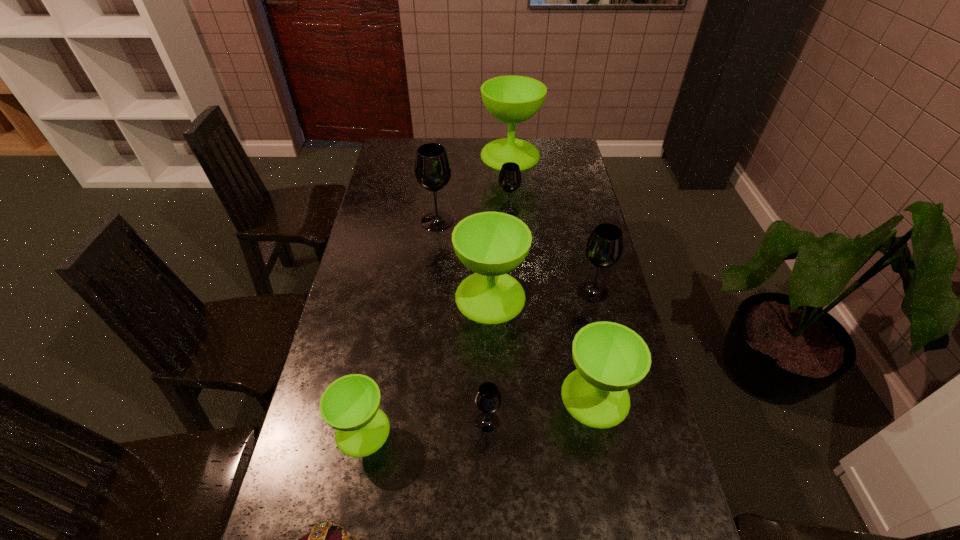
Locate an element on the screen. The width and height of the screenshot is (960, 540). vacant space that satisfies the following two spatial constraints: 1. on the back side of the second smallest green wineglass; 2. on the right side of the smallest green wineglass is located at coordinates (370, 396).